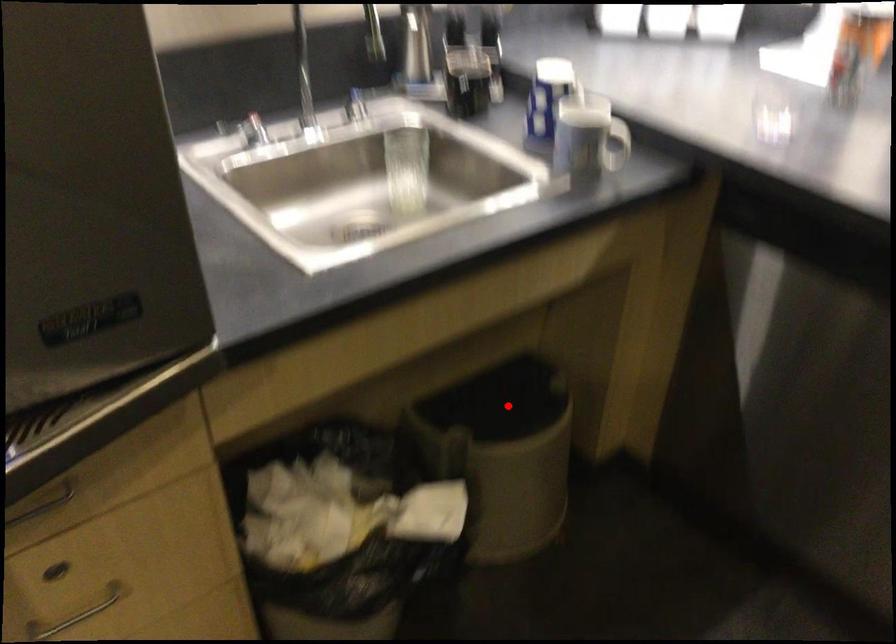
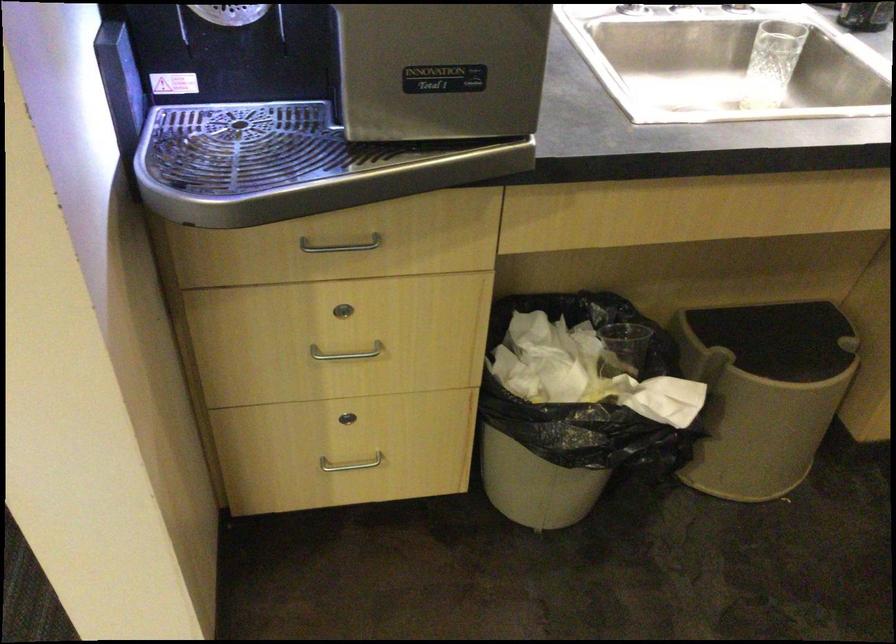
Find the pixel in the second image that matches the highlighted location in the first image.

(780, 339)